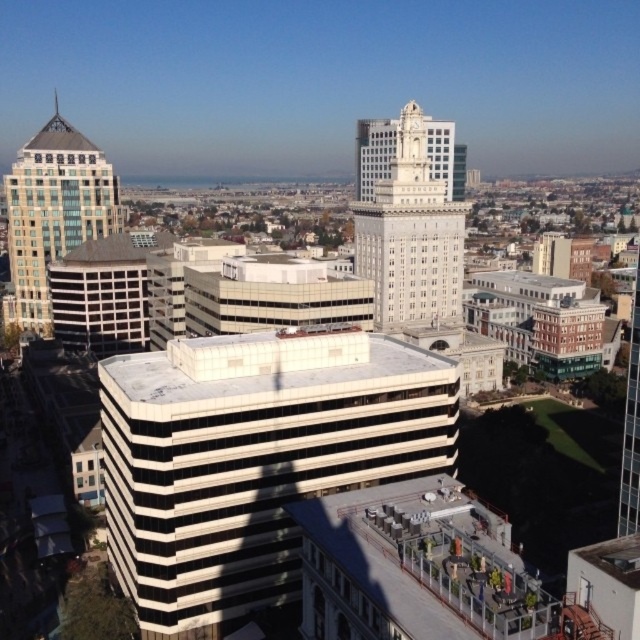
Question: Which of these objects is positioned farthest from the matte glass building at upper left?

Choices:
 (A) white striped building at center
 (B) white marble clock tower at center

Answer: (A)

Question: Does white striped building at center have a smaller size compared to matte glass building at upper left?

Choices:
 (A) yes
 (B) no

Answer: (A)

Question: Can you confirm if white striped building at center is smaller than matte glass building at upper left?

Choices:
 (A) no
 (B) yes

Answer: (B)

Question: Which object is farther from the camera taking this photo?

Choices:
 (A) white striped building at center
 (B) matte glass building at upper left
 (C) white marble clock tower at center

Answer: (B)

Question: Considering the real-world distances, which object is closest to the matte glass building at upper left?

Choices:
 (A) white marble clock tower at center
 (B) white striped building at center

Answer: (A)

Question: Is white marble clock tower at center wider than matte glass building at upper left?

Choices:
 (A) yes
 (B) no

Answer: (B)